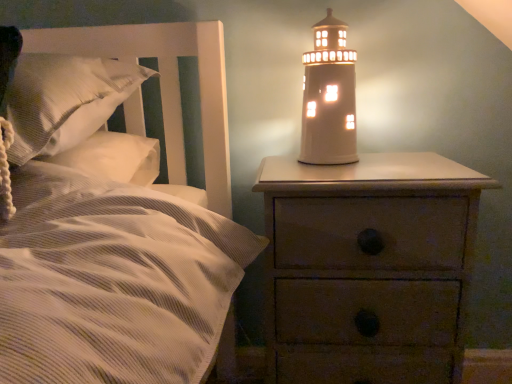
Locate an element on the screen. Image resolution: width=512 pixels, height=384 pixels. free point above wooden nightstand at right (from a real-world perspective) is located at coordinates (364, 168).